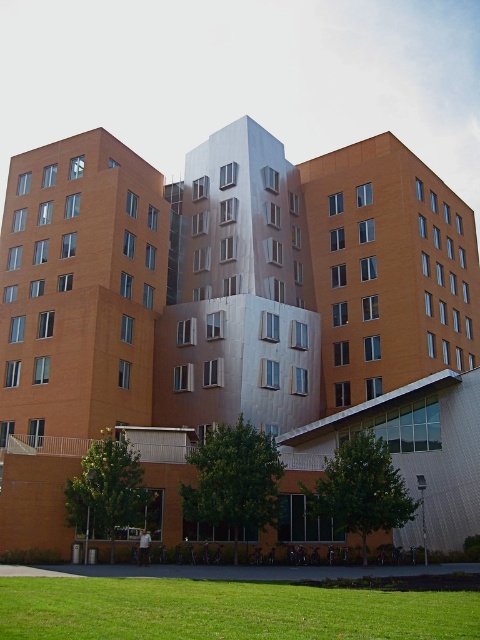
You are standing in front of the modern architectural structure. There is a point at coordinates point (235, 321). Which part of the building does this point belong to?

The point (235, 321) is on the matte orange building at center.

From the picture: You are standing at the entrance of the building and want to locate the matte orange building at center. According to the coordinates provided, where exactly is it positioned?

The matte orange building at center is positioned at coordinates point (x=235, y=321).

You are standing in a park and see the matte orange building at center and the green grass at lower center. Which object is located to the right of the other?

The matte orange building at center is positioned on the right side of green grass at lower center.